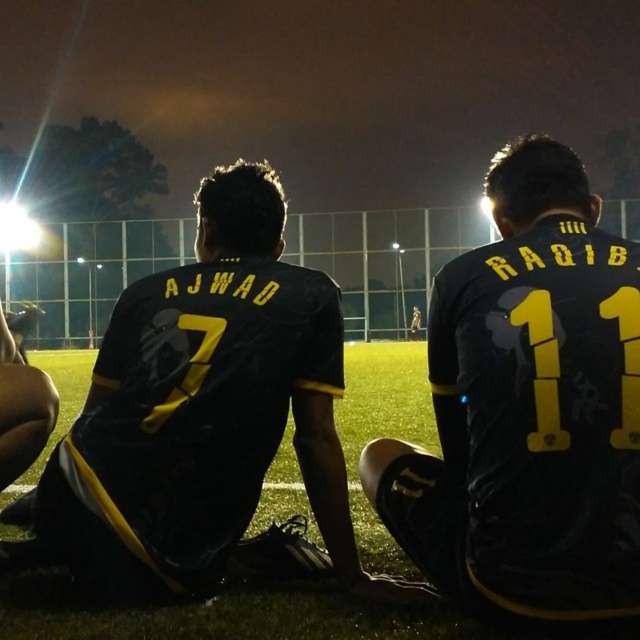
Question: Among these objects, which one is farthest from the camera?

Choices:
 (A) black matte jersey at center
 (B) matte black jersey at left

Answer: (B)

Question: Which point is closer to the camera?

Choices:
 (A) black matte jersey at center
 (B) matte black jersey at left

Answer: (A)

Question: Is black matte jersey at center further to the viewer compared to matte black jersey at left?

Choices:
 (A) no
 (B) yes

Answer: (A)

Question: Can you confirm if black matte jersey at center is thinner than matte black jersey at left?

Choices:
 (A) yes
 (B) no

Answer: (A)

Question: Can you confirm if black matte jersey at center is smaller than matte black jersey at left?

Choices:
 (A) yes
 (B) no

Answer: (B)